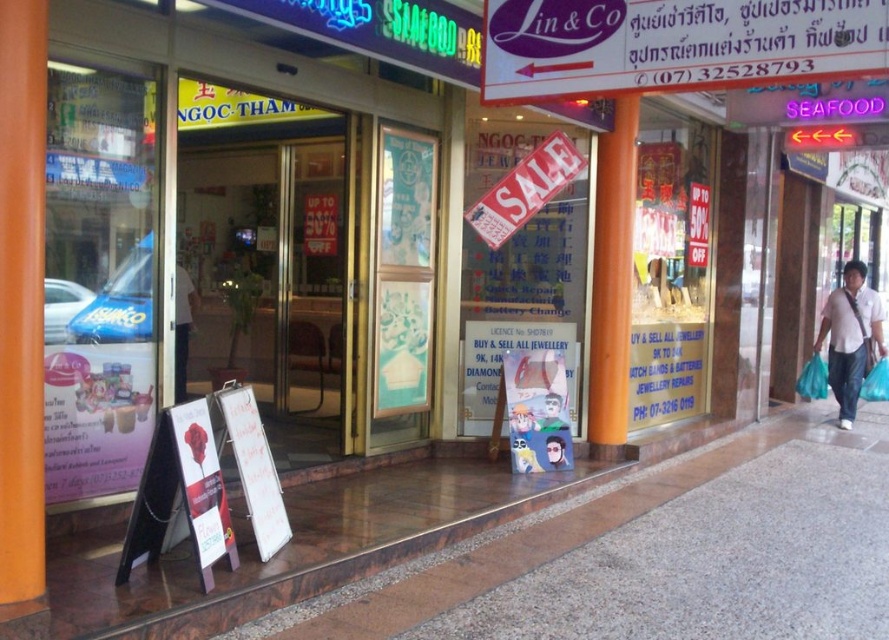
You are standing at the entrance of the store and want to take a photo of the SALE sign. The SALE sign is located at point (603, 340). If your camera has a focal length of 50mm and you want to capture the entire sign in the frame, what is the minimum distance you need to be from the sign to ensure it fits?

The distance between point (603, 340) and the camera is 7.08 meters. To capture the entire SALE sign in the frame with a 50mm focal length, you need to be at least 7.08 meters away from the sign.

You are standing in front of the storefront and want to walk to the entrance. Which object will you step on first, the brown polished stone pavement at lower center or the orange matte pillar at center?

The brown polished stone pavement at lower center is located below the orange matte pillar at center, so you will step on the brown polished stone pavement at lower center first before reaching the entrance.